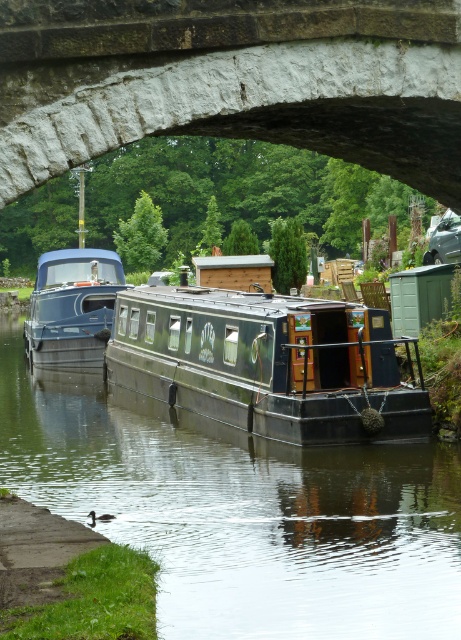
Between stone arch at center and dark green wooden barge at center, which one has less height?

With less height is stone arch at center.

What do you see at coordinates (232, 81) in the screenshot?
I see `stone arch at center` at bounding box center [232, 81].

What are the coordinates of `stone arch at center` in the screenshot? It's located at (232, 81).

Between green matte boat at center and matte blue boat at left, which one is positioned lower?

green matte boat at center

Who is taller, green matte boat at center or matte blue boat at left?

With more height is matte blue boat at left.

Locate an element on the screen. Image resolution: width=461 pixels, height=640 pixels. green matte boat at center is located at coordinates (242, 512).

Image resolution: width=461 pixels, height=640 pixels. What are the coordinates of `green matte boat at center` in the screenshot? It's located at (242, 512).

Which of these two, stone arch at center or matte blue boat at left, stands taller?

Standing taller between the two is matte blue boat at left.

Between point (409, 172) and point (100, 316), which one is positioned behind?

Point (100, 316)

Image resolution: width=461 pixels, height=640 pixels. Describe the element at coordinates (232, 81) in the screenshot. I see `stone arch at center` at that location.

This screenshot has width=461, height=640. Find the location of `stone arch at center`. stone arch at center is located at coordinates (232, 81).